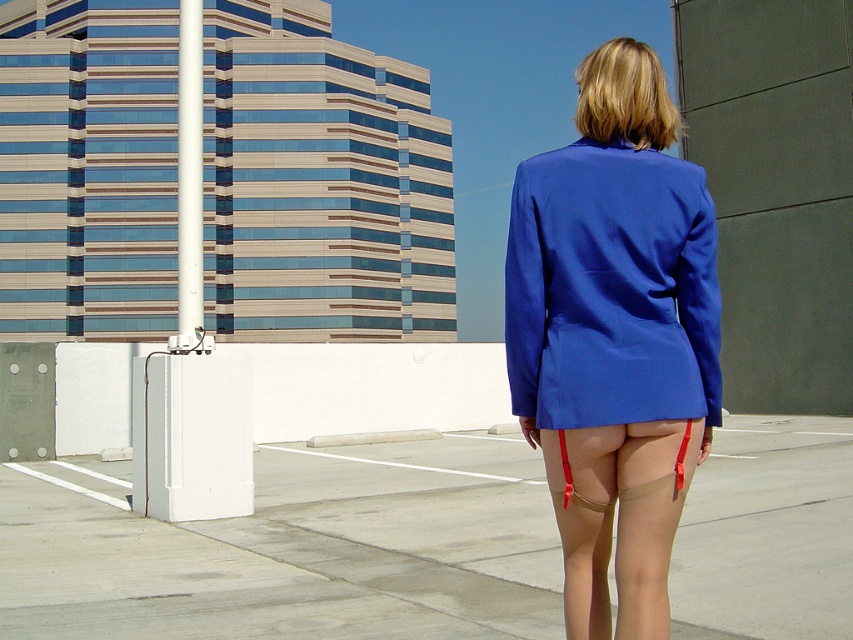
Describe the element at coordinates (299, 552) in the screenshot. I see `concrete at center` at that location.

Between concrete at center and matte blue blazer at center, which one is positioned lower?

Positioned lower is concrete at center.

Locate an element on the screen. concrete at center is located at coordinates (299, 552).

Between point (659, 385) and point (523, 404), which one is positioned in front?

Point (659, 385) is more forward.

Between point (612, 508) and point (683, 211), which one is positioned in front?

Point (683, 211) is in front.

Identify the location of blue smooth blazer at center. (614, 336).

Can you confirm if concrete at center is wider than blue smooth blazer at center?

Indeed, concrete at center has a greater width compared to blue smooth blazer at center.

Image resolution: width=853 pixels, height=640 pixels. I want to click on concrete at center, so click(x=299, y=552).

Locate an element on the screen. The width and height of the screenshot is (853, 640). concrete at center is located at coordinates click(299, 552).